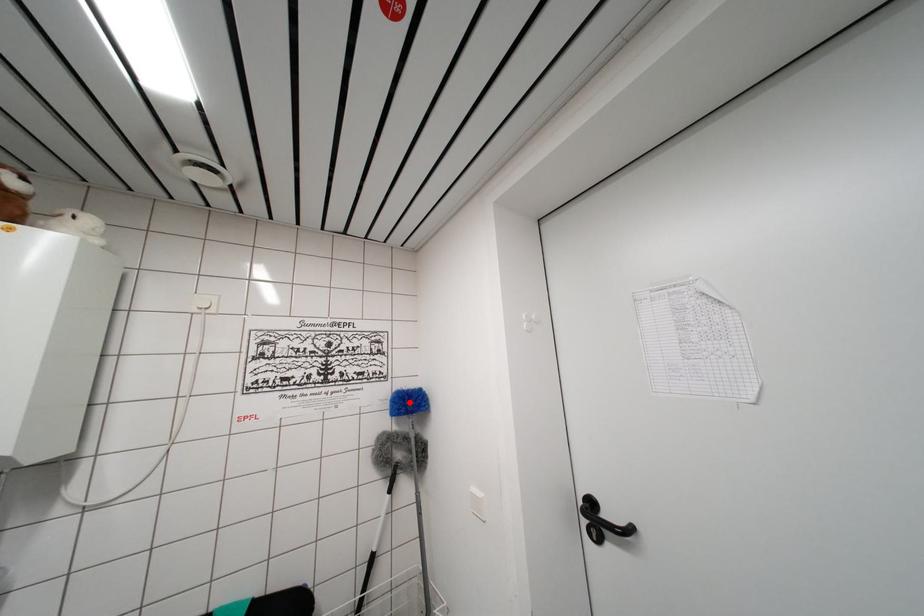
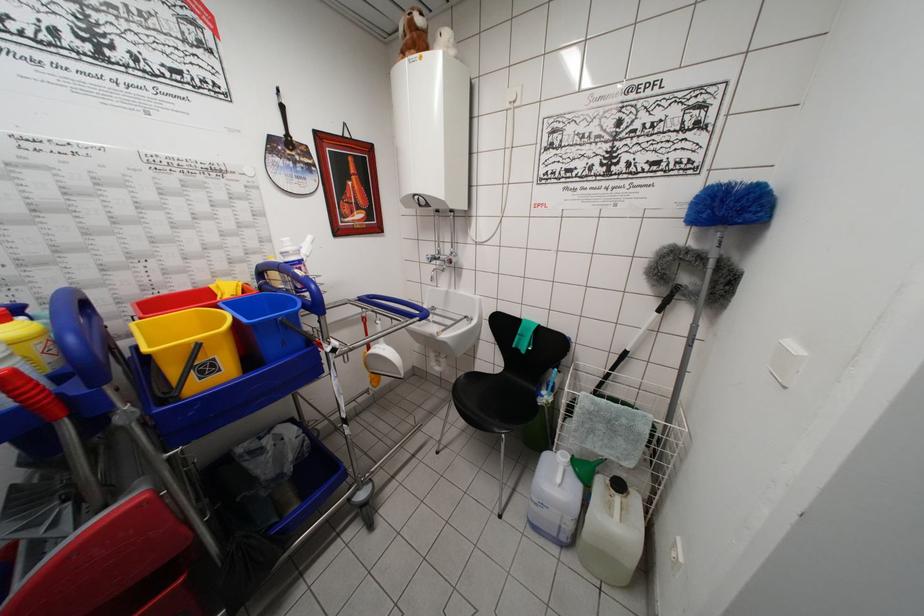
Find the pixel in the second image that matches the highlighted location in the first image.

(723, 199)